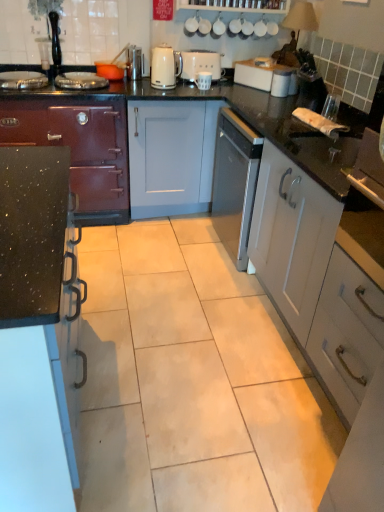
Locate an element on the screen. The width and height of the screenshot is (384, 512). vacant point to the left of white glossy kettle at upper center is located at coordinates (141, 87).